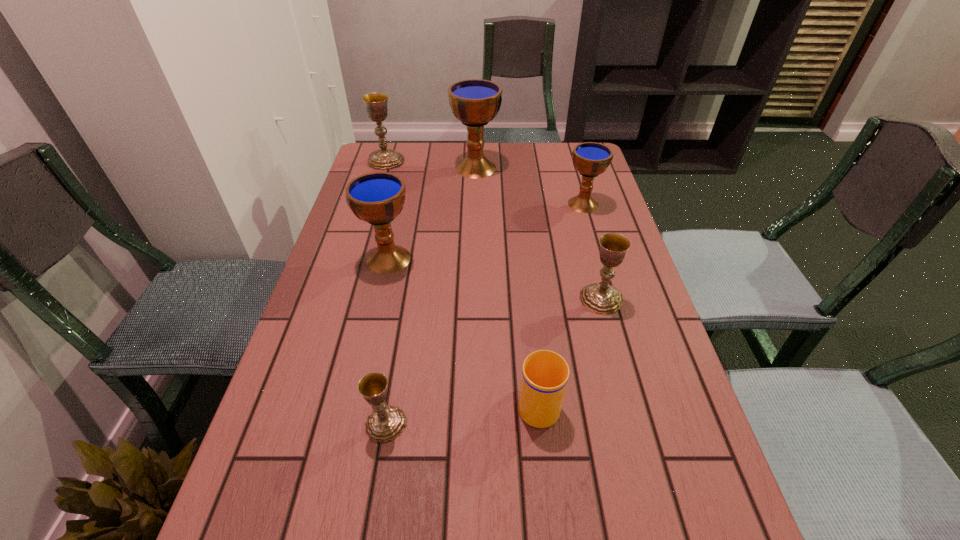
Find the location of a particular element. The height and width of the screenshot is (540, 960). unoccupied area between the fourth chalice from left to right and the second biggest gold chalice is located at coordinates (539, 233).

Find the location of a particular element. The width and height of the screenshot is (960, 540). free space between the second nearest blue chalice and the second gold chalice from left to right is located at coordinates (485, 314).

At what (x,y) coordinates should I click in order to perform the action: click on vacant point located between the rightmost blue chalice and the second nearest chalice. Please return your answer as a coordinate pair (x, y). This screenshot has height=540, width=960. Looking at the image, I should click on (592, 252).

What are the coordinates of `unoccupied position between the second farthest gold chalice and the farthest gold chalice` in the screenshot? It's located at (493, 230).

Locate an element on the screen. blank region between the beige cup and the second farthest gold chalice is located at coordinates (570, 350).

Locate an element on the screen. The image size is (960, 540). free space between the second smallest gold chalice and the leftmost blue chalice is located at coordinates (495, 279).

At what (x,y) coordinates should I click in order to perform the action: click on object that is the third nearest to the farthest gold chalice. Please return your answer as a coordinate pair (x, y). The width and height of the screenshot is (960, 540). Looking at the image, I should click on (590, 159).

Select which object appears as the sixth closest to the second biggest gold chalice. Please provide its 2D coordinates. Your answer should be formatted as a tuple, i.e. [(x, y)], where the tuple contains the x and y coordinates of a point satisfying the conditions above.

[(376, 103)]

Image resolution: width=960 pixels, height=540 pixels. I want to click on the fifth closest chalice to the cup, so click(x=475, y=102).

In order to click on chalice that is the fifth nearest to the fifth farthest chalice in this screenshot , I will do `click(376, 103)`.